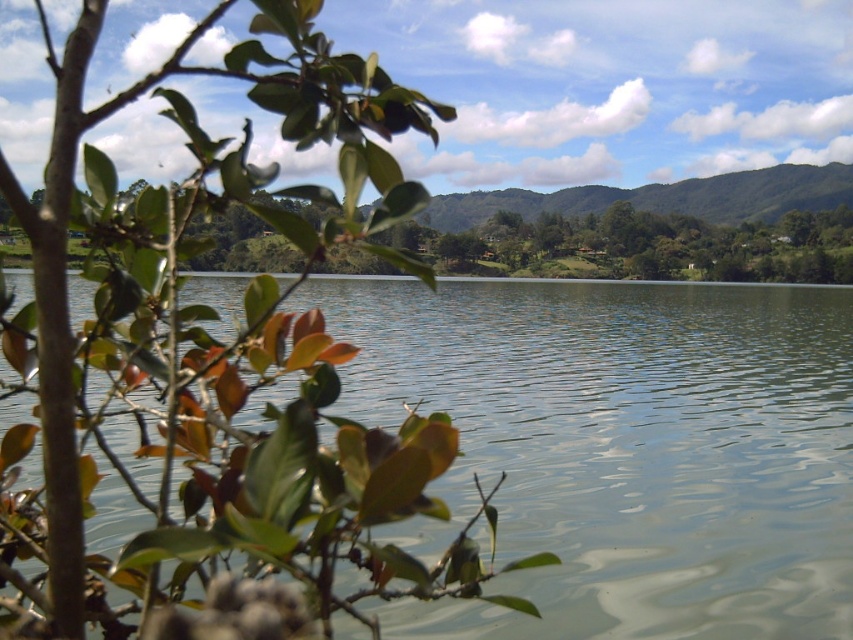
Is green glossy leaves at left positioned behind green smooth water at center?

No, it is not.

In the scene shown: Between green glossy leaves at left and green smooth water at center, which one is positioned lower?

Positioned lower is green smooth water at center.

The width and height of the screenshot is (853, 640). Identify the location of green glossy leaves at left. (215, 368).